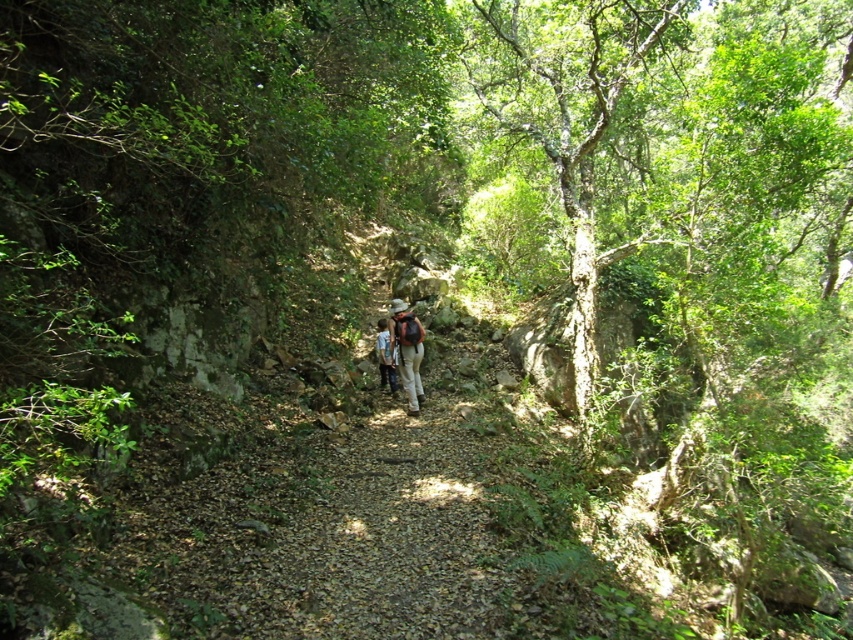
Does matte brown backpack at center appear on the right side of blue denim jeans at center?

Indeed, matte brown backpack at center is positioned on the right side of blue denim jeans at center.

Which is more to the right, matte brown backpack at center or blue denim jeans at center?

From the viewer's perspective, matte brown backpack at center appears more on the right side.

Describe the element at coordinates (405, 349) in the screenshot. The image size is (853, 640). I see `matte brown backpack at center` at that location.

Where is `matte brown backpack at center`? matte brown backpack at center is located at coordinates (405, 349).

Can you confirm if green rough bark tree at center is taller than blue denim jeans at center?

Indeed, green rough bark tree at center has a greater height compared to blue denim jeans at center.

Find the location of `green rough bark tree at center`. green rough bark tree at center is located at coordinates (567, 120).

Does green rough bark tree at center lie behind matte brown backpack at center?

No, green rough bark tree at center is in front of matte brown backpack at center.

Does point (605, 29) come closer to viewer compared to point (410, 332)?

No, it is behind (410, 332).

What do you see at coordinates (567, 120) in the screenshot?
I see `green rough bark tree at center` at bounding box center [567, 120].

Find the location of a particular element. The height and width of the screenshot is (640, 853). green rough bark tree at center is located at coordinates coord(567,120).